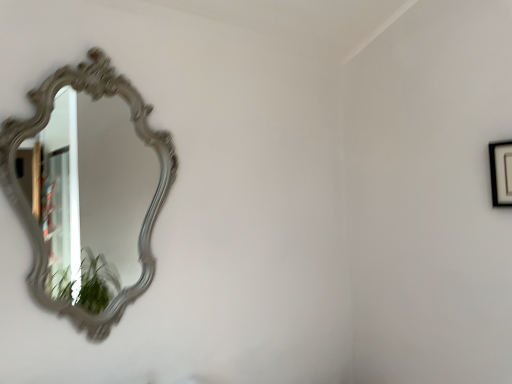
This screenshot has height=384, width=512. What do you see at coordinates (91, 199) in the screenshot? I see `silver metallic mirror at left` at bounding box center [91, 199].

At what (x,y) coordinates should I click in order to perform the action: click on silver metallic mirror at left. Please return your answer as a coordinate pair (x, y). Image resolution: width=512 pixels, height=384 pixels. Looking at the image, I should click on (91, 199).

This screenshot has width=512, height=384. I want to click on silver metallic mirror at left, so click(x=91, y=199).